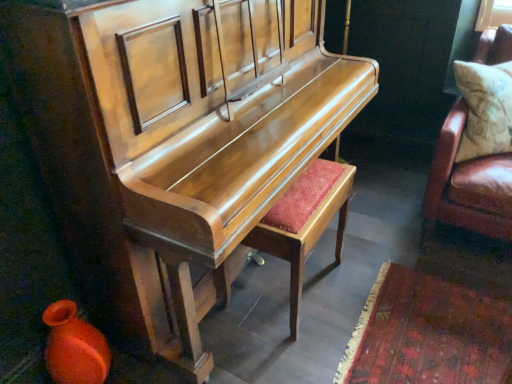
The width and height of the screenshot is (512, 384). In order to click on free space in front of matte wood stool at center in this screenshot , I will do `click(306, 352)`.